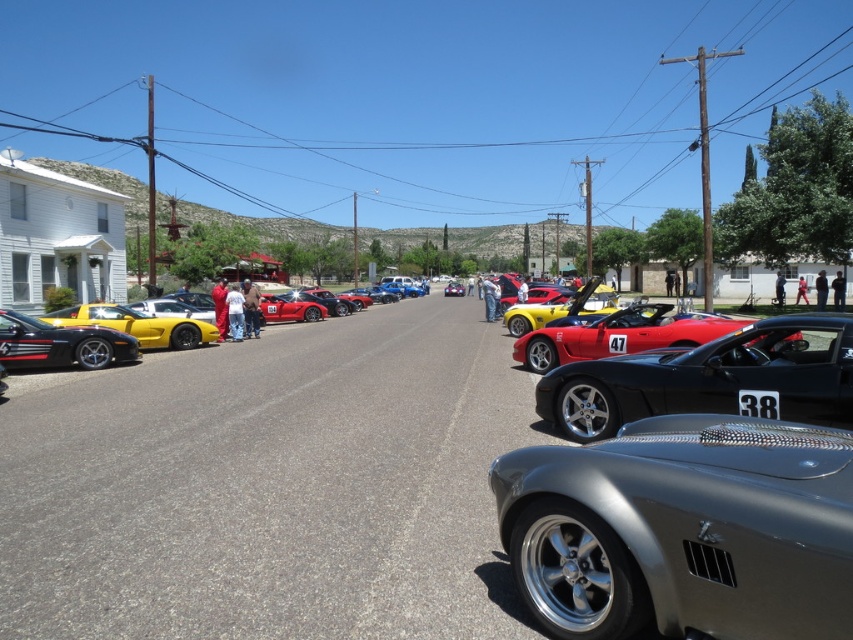
Is metallic silver car at lower right below shiny black sports car at left?

Correct, metallic silver car at lower right is located below shiny black sports car at left.

Looking at this image, which is above, metallic silver car at lower right or shiny black sports car at left?

shiny black sports car at left is higher up.

Is point (804, 458) positioned in front of point (16, 317)?

Yes, it is in front of point (16, 317).

Identify the location of metallic silver car at lower right. (683, 529).

Does shiny black sports car at left have a greater width compared to shiny red sports car at center?

No.

Can you confirm if shiny black sports car at left is smaller than shiny red sports car at center?

Indeed, shiny black sports car at left has a smaller size compared to shiny red sports car at center.

Does point (115, 356) lie behind point (293, 314)?

No.

Where is `shiny black sports car at left`? This screenshot has width=853, height=640. shiny black sports car at left is located at coordinates (61, 344).

Can you confirm if metallic silver car at lower right is positioned to the left of shiny red sports car at center?

No, metallic silver car at lower right is not to the left of shiny red sports car at center.

Can you confirm if metallic silver car at lower right is taller than shiny red sports car at center?

Incorrect, metallic silver car at lower right's height is not larger of shiny red sports car at center's.

The height and width of the screenshot is (640, 853). I want to click on metallic silver car at lower right, so click(x=683, y=529).